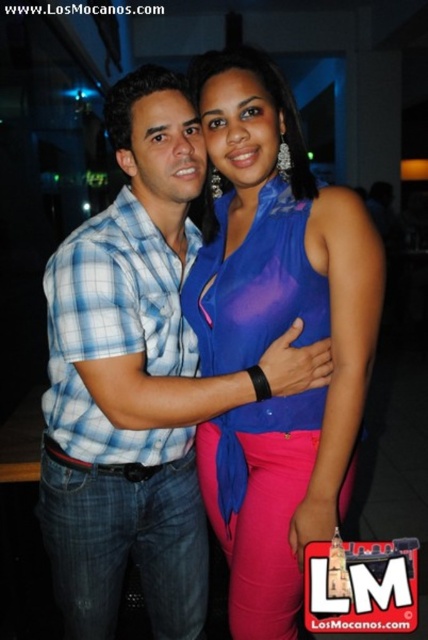
You are standing in the center of the room and want to hand a drink to the person wearing the blue plaid shirt at center. In which direction should you move to reach them?

The blue plaid shirt at center is located at point 0.594 on the x axis and 0.322 on the y axis, so you should move towards the right and forward to reach them.

You are a photographer trying to capture a candid shot of the two people in the image. You notice two points marked in the scene. The first point is at coordinate point (109, 227) and the second point is at coordinate point (234, 138). Based on their positions, which point is closer to the photographer?

Point (234, 138) is closer to the photographer because it is in front of point (109, 227) according to the spatial relationship provided.